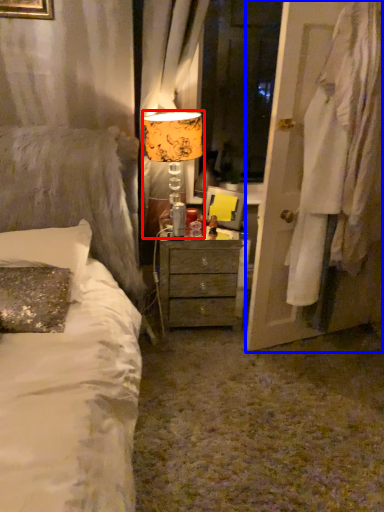
Question: Which object is closer to the camera taking this photo, table lamp (highlighted by a red box) or door (highlighted by a blue box)?

Choices:
 (A) table lamp
 (B) door

Answer: (B)